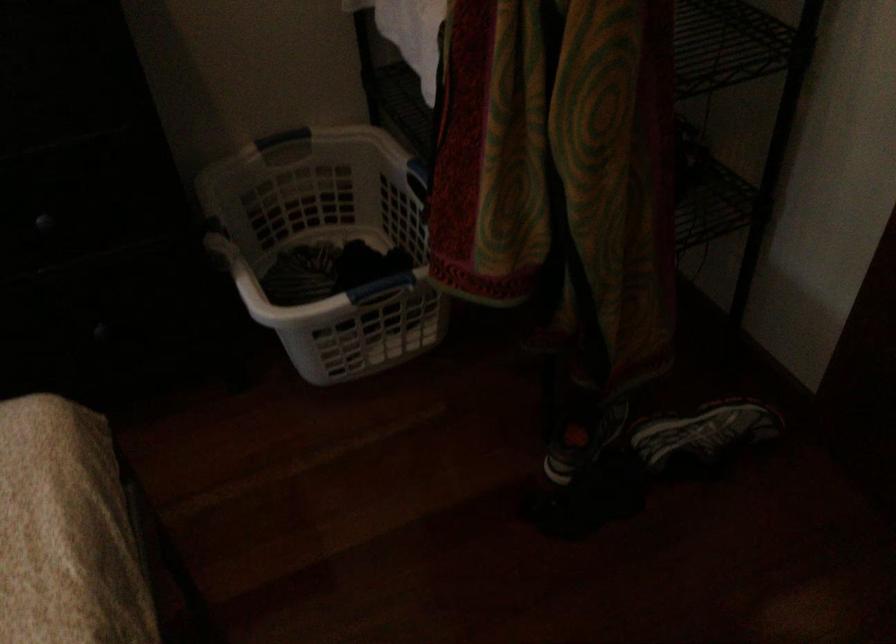
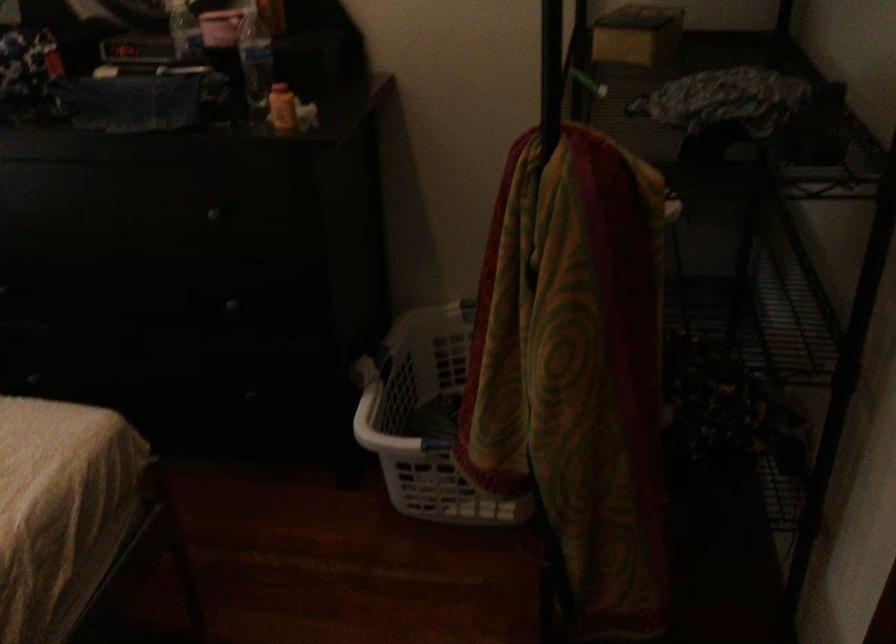
Question: Based on the continuous images, in which direction is the camera rotating? Reply with the corresponding letter.

Choices:
 (A) Left
 (B) Right
 (C) Up
 (D) Down

Answer: (A)